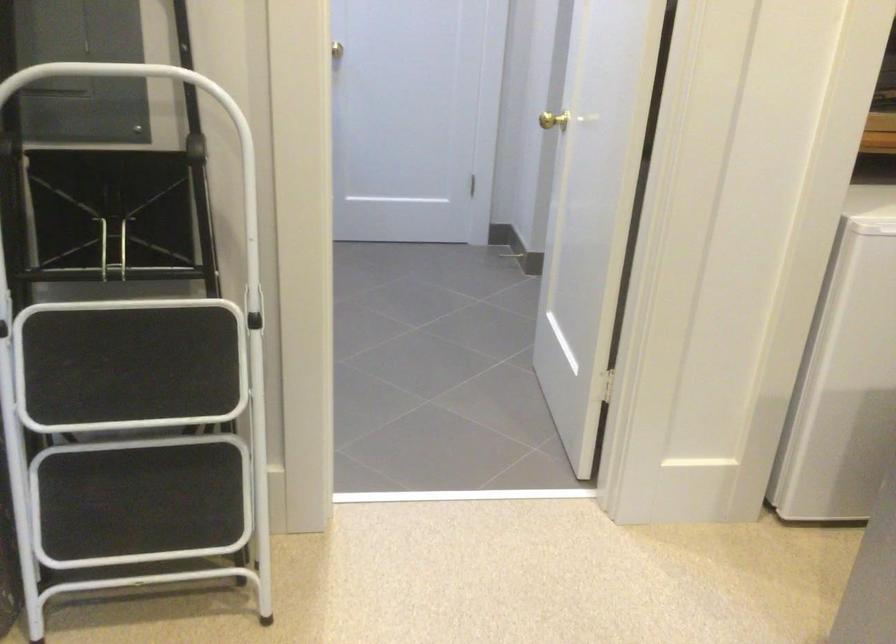
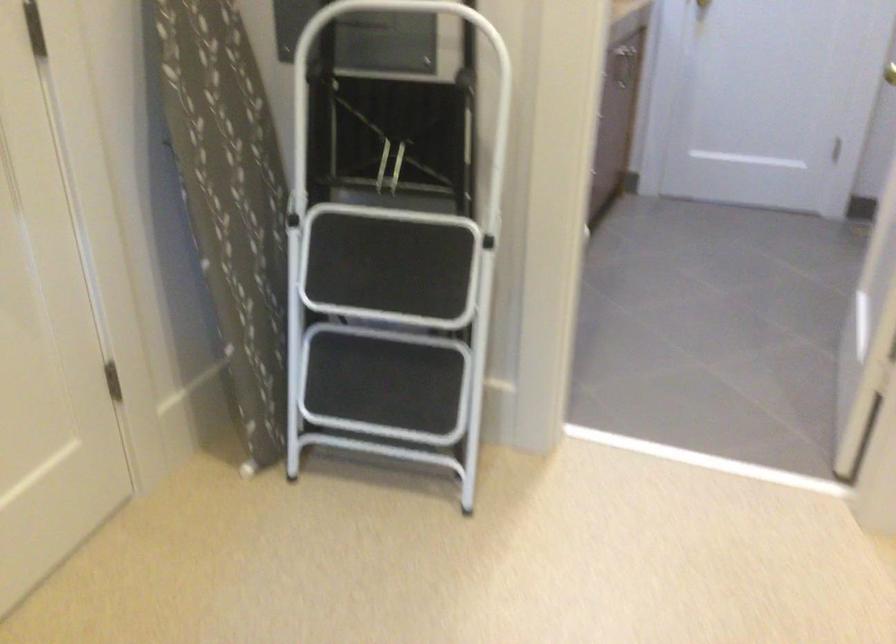
In the second image, find the point that corresponds to point 509,118 in the first image.

(890, 73)